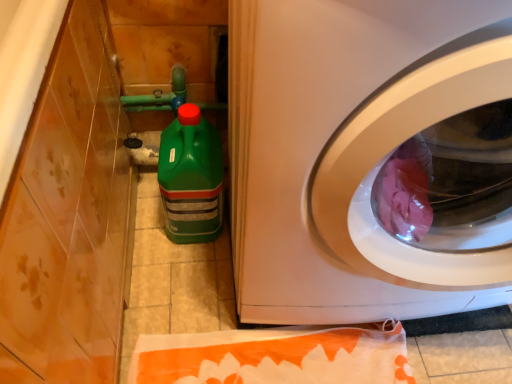
This screenshot has height=384, width=512. Describe the element at coordinates (344, 143) in the screenshot. I see `white glossy washing machine at center` at that location.

Where is `white glossy washing machine at center`? white glossy washing machine at center is located at coordinates (344, 143).

Where is `green plastic bottle at lower left`? green plastic bottle at lower left is located at coordinates (x=191, y=177).

This screenshot has width=512, height=384. What do you see at coordinates (191, 177) in the screenshot?
I see `green plastic bottle at lower left` at bounding box center [191, 177].

Find the location of a particular element. This screenshot has height=384, width=512. white glossy washing machine at center is located at coordinates (344, 143).

Considering the relative positions of green plastic bottle at lower left and white glossy washing machine at center in the image provided, is green plastic bottle at lower left to the left or to the right of white glossy washing machine at center?

Based on their positions, green plastic bottle at lower left is located to the left of white glossy washing machine at center.

Looking at this image, is green plastic bottle at lower left closer to the viewer compared to white glossy washing machine at center?

No, it is behind white glossy washing machine at center.

Does point (214, 196) come closer to viewer compared to point (365, 47)?

No.

From the image's perspective, is green plastic bottle at lower left positioned above or below white glossy washing machine at center?

green plastic bottle at lower left is situated lower than white glossy washing machine at center in the image.

Based on the photo, from a real-world perspective, who is located lower, green plastic bottle at lower left or white glossy washing machine at center?

green plastic bottle at lower left, from a real-world perspective.

Is green plastic bottle at lower left thinner than white glossy washing machine at center?

Yes, green plastic bottle at lower left is thinner than white glossy washing machine at center.

Is green plastic bottle at lower left shorter than white glossy washing machine at center?

Correct, green plastic bottle at lower left is not as tall as white glossy washing machine at center.

Can you confirm if green plastic bottle at lower left is bigger than white glossy washing machine at center?

No, green plastic bottle at lower left is not bigger than white glossy washing machine at center.

Do you think green plastic bottle at lower left is within white glossy washing machine at center, or outside of it?

green plastic bottle at lower left lies outside white glossy washing machine at center.

Is green plastic bottle at lower left beside white glossy washing machine at center?

There is a gap between green plastic bottle at lower left and white glossy washing machine at center.

Is green plastic bottle at lower left oriented towards white glossy washing machine at center?

No, green plastic bottle at lower left is not oriented towards white glossy washing machine at center.

Where is `washing machine located above the green plastic bottle at lower left (from a real-world perspective)`? washing machine located above the green plastic bottle at lower left (from a real-world perspective) is located at coordinates (344, 143).

Does white glossy washing machine at center appear on the left side of green plastic bottle at lower left?

In fact, white glossy washing machine at center is to the right of green plastic bottle at lower left.

Is white glossy washing machine at center behind green plastic bottle at lower left?

No, white glossy washing machine at center is in front of green plastic bottle at lower left.

Which is more distant, (337,123) or (183,176)?

The point (183,176) is farther.

From the image's perspective, which one is positioned lower, white glossy washing machine at center or green plastic bottle at lower left?

green plastic bottle at lower left is shown below in the image.

From a real-world perspective, is white glossy washing machine at center positioned under green plastic bottle at lower left based on gravity?

No, from a real-world perspective, white glossy washing machine at center is not beneath green plastic bottle at lower left.

Between white glossy washing machine at center and green plastic bottle at lower left, which one has larger width?

white glossy washing machine at center.

Which of these two, white glossy washing machine at center or green plastic bottle at lower left, stands taller?

white glossy washing machine at center.

Based on the photo, in terms of size, does white glossy washing machine at center appear bigger or smaller than green plastic bottle at lower left?

white glossy washing machine at center is bigger than green plastic bottle at lower left.

Is white glossy washing machine at center surrounding green plastic bottle at lower left?

No.

Is white glossy washing machine at center in contact with green plastic bottle at lower left?

No, white glossy washing machine at center is not touching green plastic bottle at lower left.

Could you tell me if white glossy washing machine at center is facing green plastic bottle at lower left?

No.

How many degrees apart are the facing directions of white glossy washing machine at center and green plastic bottle at lower left?

0.000611 degrees separate the facing orientations of white glossy washing machine at center and green plastic bottle at lower left.

Find the location of `cleaning product behind the white glossy washing machine at center`. cleaning product behind the white glossy washing machine at center is located at coordinates (191, 177).

Where is `cleaning product located below the white glossy washing machine at center (from the image's perspective)`? This screenshot has height=384, width=512. cleaning product located below the white glossy washing machine at center (from the image's perspective) is located at coordinates (191, 177).

I want to click on cleaning product to the left of white glossy washing machine at center, so click(191, 177).